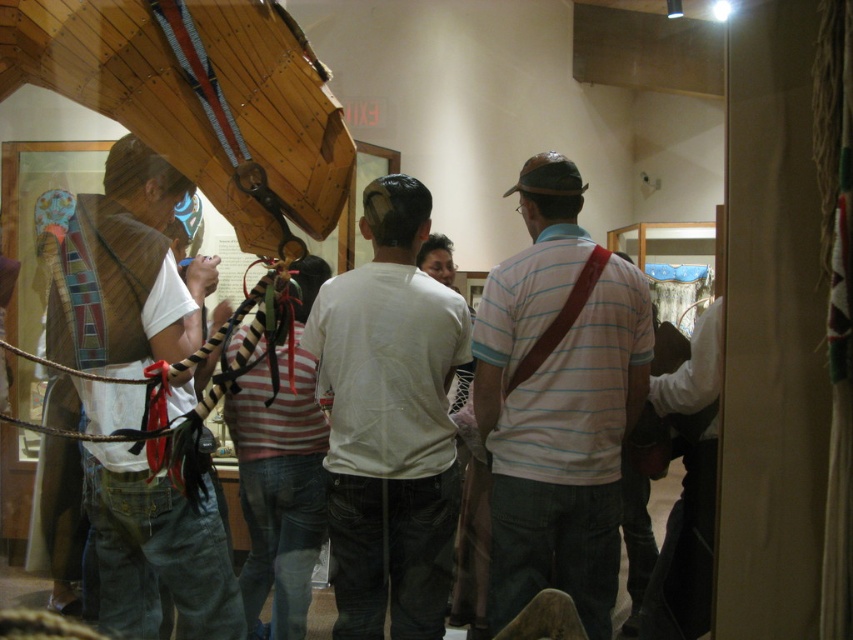
You are a photographer trying to capture a clear shot of both the white striped shirt at center and the white matte shirt at center. Which one would appear larger in your photo?

The white striped shirt at center would appear larger in the photo because it is closer to the viewer than the white matte shirt at center.

You are a photographer standing in the museum and want to capture both the white striped shirt at center and the matte brown vest at left in a single shot. The camera you are using has a maximum focus range of 36 inches. Can you fit both subjects within the camera focus range?

The white striped shirt at center is 36.14 inches from matte brown vest at left. Since the distance between them is slightly over the camera maximum focus range of 36 inches, you cannot fit both subjects within the camera focus range.